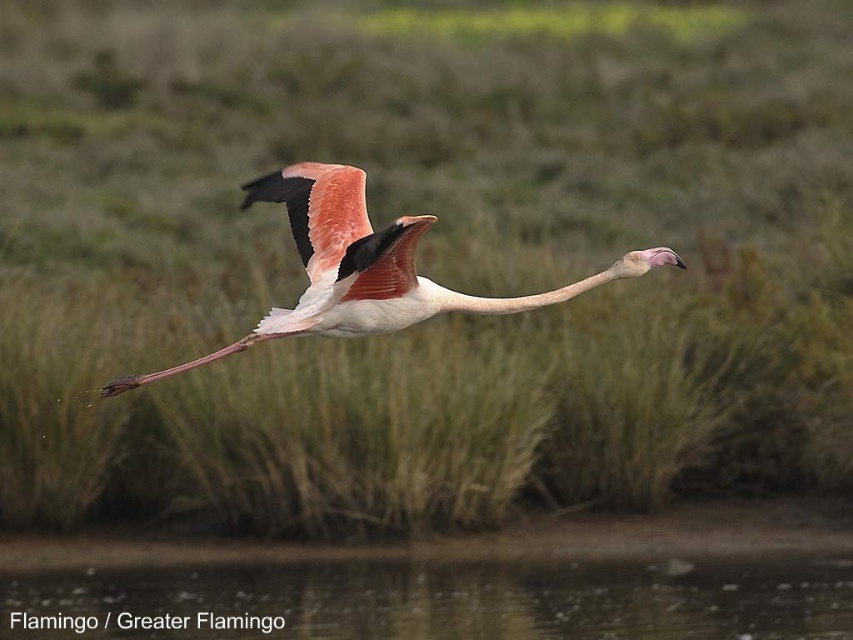
You are a birdwatcher observing the scene. You notice the transparent water at lower center and the pink feathered flamingo at center. Which object takes up more space in the image?

The pink feathered flamingo at center takes up more space in the image than the transparent water at lower center, as the transparent water occupies less space according to the description.

You are a birdwatcher observing the scene. You notice the transparent water at lower center and the pink feathered flamingo at center. Which object is taller in the image?

The pink feathered flamingo at center is taller than the transparent water at lower center.